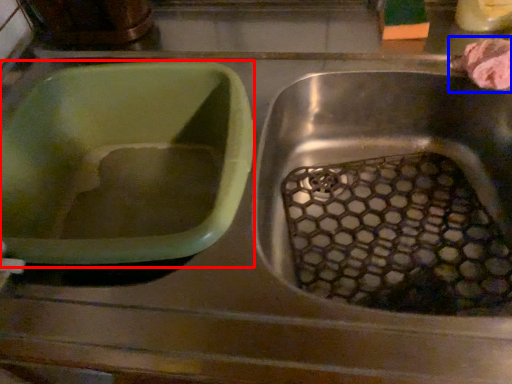
Question: Which object is further to the camera taking this photo, basin (highlighted by a red box) or food (highlighted by a blue box)?

Choices:
 (A) basin
 (B) food

Answer: (B)